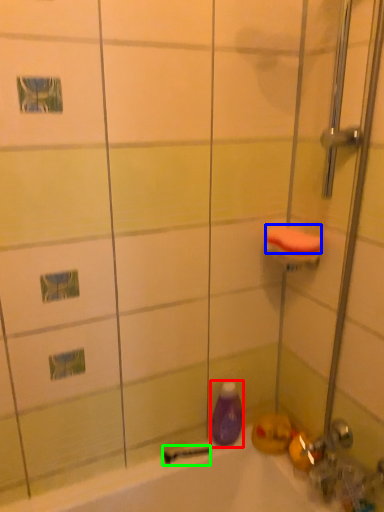
Question: Based on their relative distances, which object is nearer to cleaning product (highlighted by a red box)? Choose from soap (highlighted by a blue box) and shower (highlighted by a green box).

Choices:
 (A) soap
 (B) shower

Answer: (B)